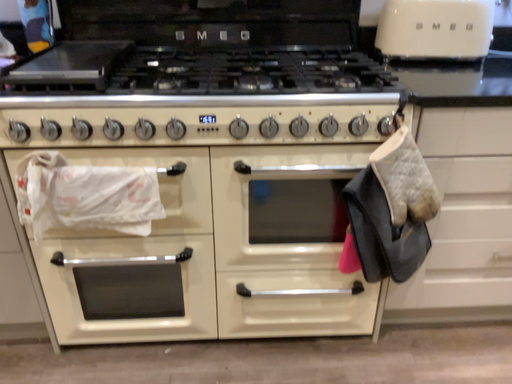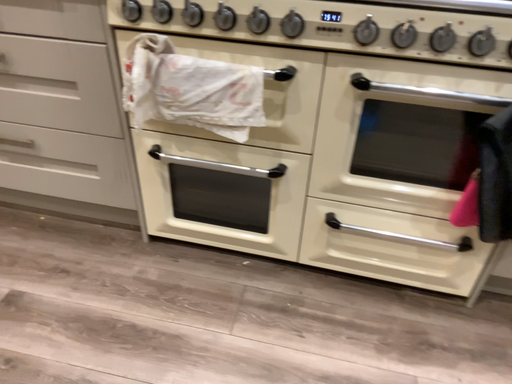
Question: Which way did the camera rotate in the video?

Choices:
 (A) rotated left
 (B) rotated right

Answer: (A)